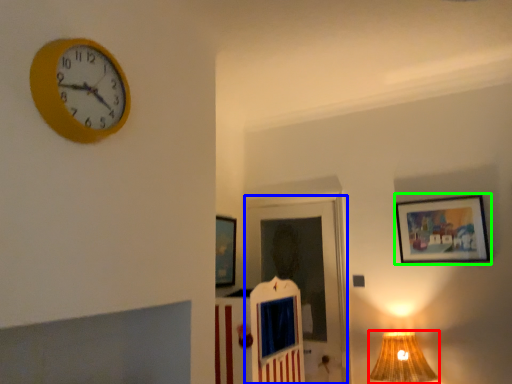
Question: Based on their relative distances, which object is nearer to table lamp (highlighted by a red box)? Choose from door (highlighted by a blue box) and picture frame (highlighted by a green box).

Choices:
 (A) door
 (B) picture frame

Answer: (B)